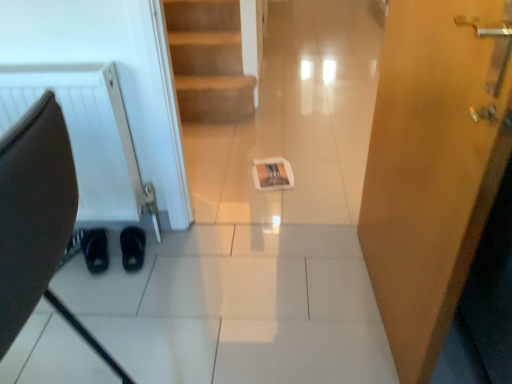
This screenshot has height=384, width=512. I want to click on empty space that is in between wooden door at right and matte paper magazine at center, so click(325, 244).